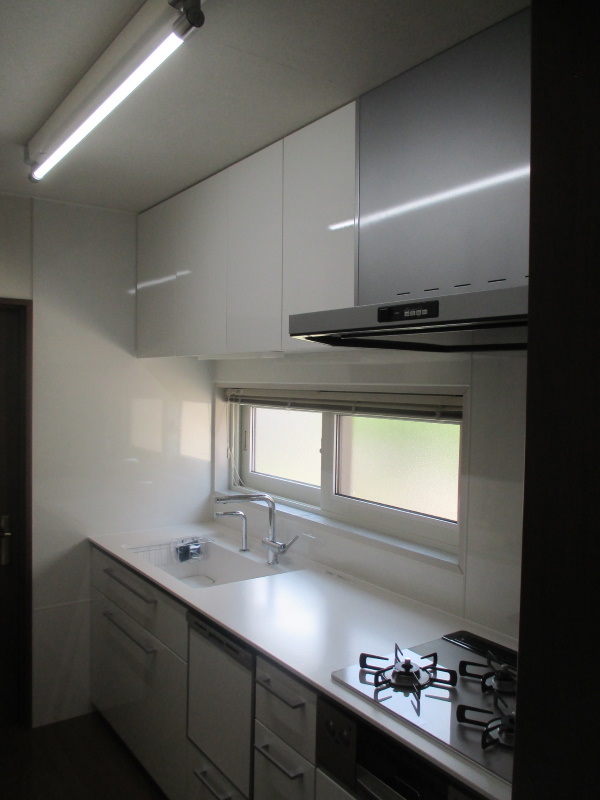
This screenshot has height=800, width=600. Identify the location of taps. 232,512, 226,498.